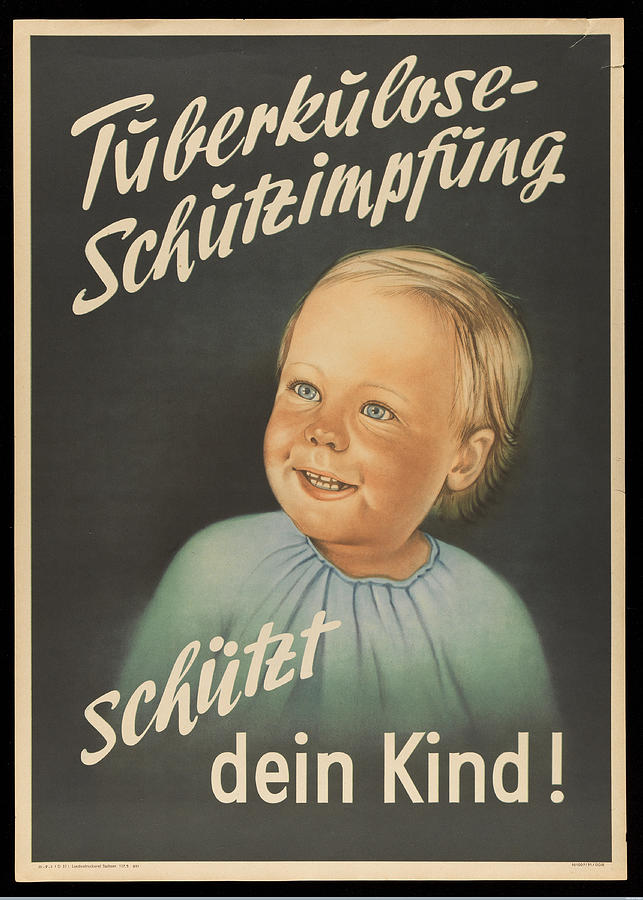
I want to click on black frame, so click(640, 880).